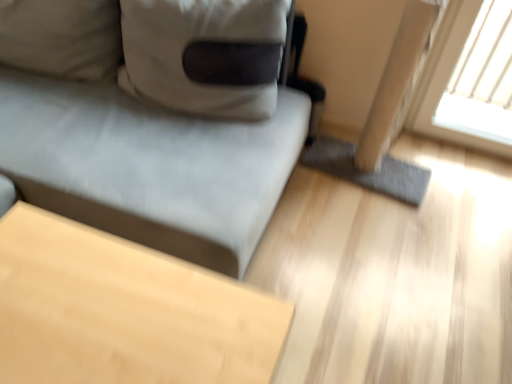
Question: Is suede-like gray couch at upper left spatially inside light wood table at lower left, or outside of it?

Choices:
 (A) inside
 (B) outside

Answer: (B)

Question: Considering the positions of point (172, 125) and point (46, 317), is point (172, 125) closer or farther from the camera than point (46, 317)?

Choices:
 (A) closer
 (B) farther

Answer: (B)

Question: Considering the positions of suede-like gray couch at upper left and light wood table at lower left in the image, is suede-like gray couch at upper left bigger or smaller than light wood table at lower left?

Choices:
 (A) big
 (B) small

Answer: (A)

Question: Considering the positions of light wood table at lower left and suede-like gray couch at upper left in the image, is light wood table at lower left wider or thinner than suede-like gray couch at upper left?

Choices:
 (A) thin
 (B) wide

Answer: (A)

Question: From their relative heights in the image, would you say light wood table at lower left is taller or shorter than suede-like gray couch at upper left?

Choices:
 (A) short
 (B) tall

Answer: (A)

Question: Looking at the image, does light wood table at lower left seem bigger or smaller compared to suede-like gray couch at upper left?

Choices:
 (A) small
 (B) big

Answer: (A)

Question: Does point (145, 357) appear closer or farther from the camera than point (215, 97)?

Choices:
 (A) closer
 (B) farther

Answer: (A)